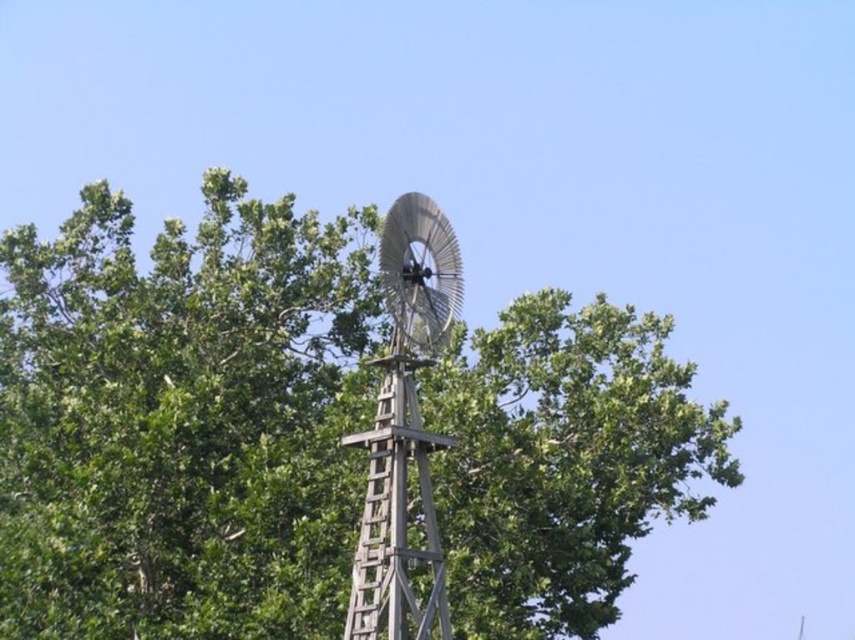
You are standing in front of the traditional windmill surrounded by trees. There is a point marked at coordinates [181,420]. What object is located at that point?

The point at [181,420] indicates a green leafy tree at center.

You are a bird looking for a place to perch. You see the green leafy tree at center and the wooden windmill at center. Which one is bigger and would provide a better perch?

The green leafy tree at center is larger than the wooden windmill at center, so it would provide a better perch.

You are standing in front of the windmill and want to determine which of the two points, point (239, 604) or point (392, 452), is closer to you. Based on the image, which point is nearer?

Point (239, 604) is closer to you because it is further to the viewer than point (392, 452).